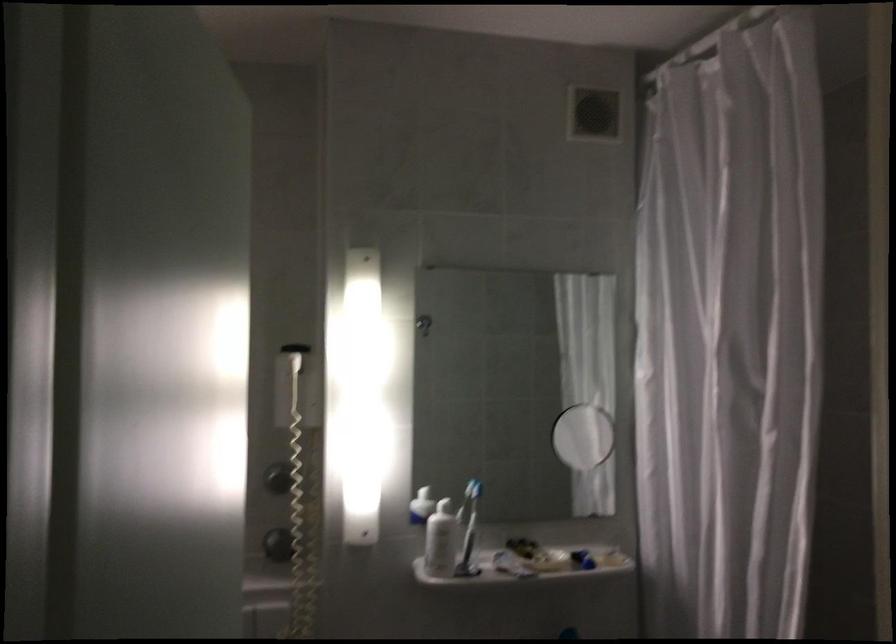
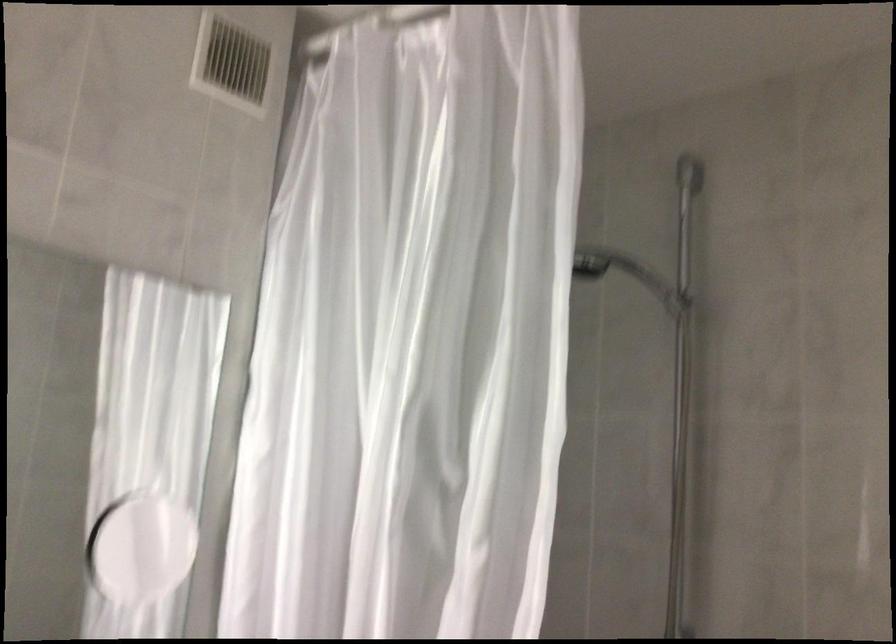
Question: The images are taken continuously from a first-person perspective. In which direction is your viewpoint rotating?

Choices:
 (A) Left
 (B) Right
 (C) Up
 (D) Down

Answer: (B)